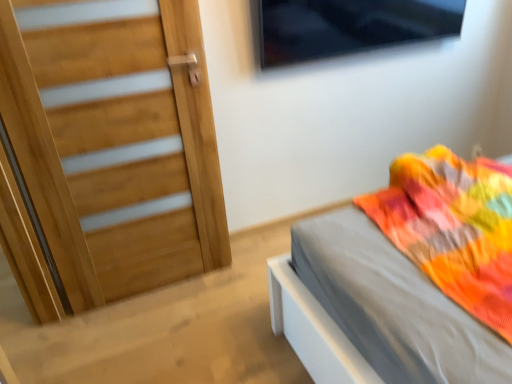
The image size is (512, 384). Identify the location of transparent glass window at upper center. (345, 27).

The height and width of the screenshot is (384, 512). Identify the location of natural wood door at left. point(108,150).

Is transparent glass window at upper center completely or partially inside natural wood door at left?

No, transparent glass window at upper center is not a part of natural wood door at left.

Where is `door below the transparent glass window at upper center (from the image's perspective)`? This screenshot has width=512, height=384. door below the transparent glass window at upper center (from the image's perspective) is located at coordinates (108, 150).

Does natural wood door at left appear on the left side of transparent glass window at upper center?

Yes.

Does natural wood door at left have a lesser height compared to transparent glass window at upper center?

No, natural wood door at left is not shorter than transparent glass window at upper center.

Is matte gray bed at right thinner than transparent glass window at upper center?

No.

Is matte gray bed at right at the right side of transparent glass window at upper center?

No.

Is matte gray bed at right in front of or behind transparent glass window at upper center in the image?

matte gray bed at right is positioned closer to the viewer than transparent glass window at upper center.

Which of these two, matte gray bed at right or transparent glass window at upper center, stands shorter?

matte gray bed at right.

Between transparent glass window at upper center and matte gray bed at right, which one has less height?

matte gray bed at right.

Would you say transparent glass window at upper center is inside or outside matte gray bed at right?

transparent glass window at upper center is spatially situated outside matte gray bed at right.

How far apart are transparent glass window at upper center and matte gray bed at right?

The distance of transparent glass window at upper center from matte gray bed at right is 4.21 feet.

From the image's perspective, is transparent glass window at upper center positioned above or below matte gray bed at right?

transparent glass window at upper center is above matte gray bed at right.

Is natural wood door at left at the back of matte gray bed at right?

No.

Between matte gray bed at right and natural wood door at left, which one has less height?

With less height is matte gray bed at right.

Is matte gray bed at right beside natural wood door at left?

matte gray bed at right and natural wood door at left are not in contact.

In terms of height, does natural wood door at left look taller or shorter compared to matte gray bed at right?

In the image, natural wood door at left appears to be taller than matte gray bed at right.

How different are the orientations of natural wood door at left and matte gray bed at right in degrees?

90.9 degrees.

Considering the relative sizes of natural wood door at left and matte gray bed at right in the image provided, is natural wood door at left smaller than matte gray bed at right?

Yes, natural wood door at left is smaller than matte gray bed at right.

How much distance is there between natural wood door at left and matte gray bed at right?

natural wood door at left is 33.96 inches from matte gray bed at right.

From a real-world perspective, between transparent glass window at upper center and natural wood door at left, who is vertically higher?

transparent glass window at upper center, from a real-world perspective.

Is transparent glass window at upper center not near natural wood door at left?

Actually, transparent glass window at upper center and natural wood door at left are a little close together.

Is natural wood door at left at the back of transparent glass window at upper center?

transparent glass window at upper center does not have its back to natural wood door at left.

Is point (266, 13) farther from camera compared to point (128, 26)?

Yes, point (266, 13) is farther from viewer.

This screenshot has height=384, width=512. In the image, there is a transparent glass window at upper center. Find the location of `door below it (from a real-world perspective)`. door below it (from a real-world perspective) is located at coordinates (108, 150).

Locate an element on the screen. The height and width of the screenshot is (384, 512). window on the right of the matte gray bed at right is located at coordinates (345, 27).

Which object lies nearer to the anchor point natural wood door at left, matte gray bed at right or transparent glass window at upper center?

matte gray bed at right.

Looking at the image, which one is located closer to matte gray bed at right, transparent glass window at upper center or natural wood door at left?

natural wood door at left is closer to matte gray bed at right.

Which object lies further to the anchor point transparent glass window at upper center, natural wood door at left or matte gray bed at right?

matte gray bed at right is further to transparent glass window at upper center.

Considering their positions, is natural wood door at left positioned further to matte gray bed at right than transparent glass window at upper center?

Based on the image, transparent glass window at upper center appears to be further to matte gray bed at right.

Estimate the real-world distances between objects in this image. Which object is closer to transparent glass window at upper center, matte gray bed at right or natural wood door at left?

natural wood door at left.

Which object lies nearer to the anchor point natural wood door at left, transparent glass window at upper center or matte gray bed at right?

Based on the image, matte gray bed at right appears to be nearer to natural wood door at left.

At what (x,y) coordinates should I click in order to perform the action: click on door between transparent glass window at upper center and matte gray bed at right from top to bottom. Please return your answer as a coordinate pair (x, y). This screenshot has width=512, height=384. Looking at the image, I should click on (108, 150).